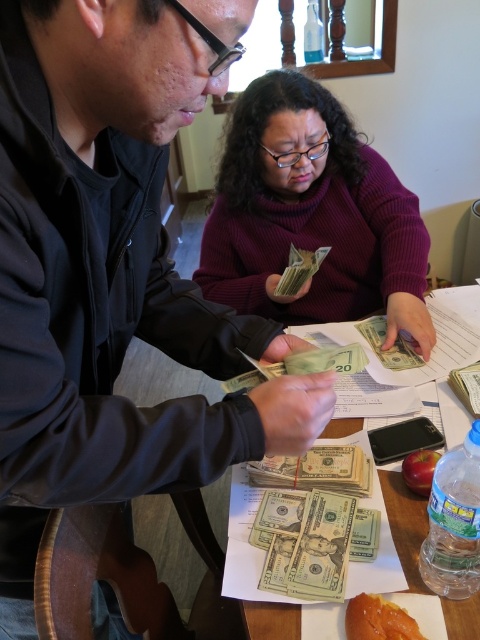
Question: Among these objects, which one is nearest to the camera?

Choices:
 (A) purple turtleneck sweater at center
 (B) green paper money at center
 (C) yellow matte apple at lower center
 (D) matte black jacket at upper left

Answer: (D)

Question: Can you confirm if matte black jacket at upper left is positioned to the left of green paper money at center?

Choices:
 (A) no
 (B) yes

Answer: (B)

Question: Is purple turtleneck sweater at center wider than yellow matte apple at lower center?

Choices:
 (A) no
 (B) yes

Answer: (B)

Question: Considering the real-world distances, which object is closest to the matte black jacket at upper left?

Choices:
 (A) yellow matte apple at lower center
 (B) purple turtleneck sweater at center

Answer: (A)

Question: Which object appears farthest from the camera in this image?

Choices:
 (A) purple turtleneck sweater at center
 (B) green paper money at center
 (C) matte black jacket at upper left

Answer: (A)

Question: Is matte black jacket at upper left below yellow matte apple at lower center?

Choices:
 (A) yes
 (B) no

Answer: (B)